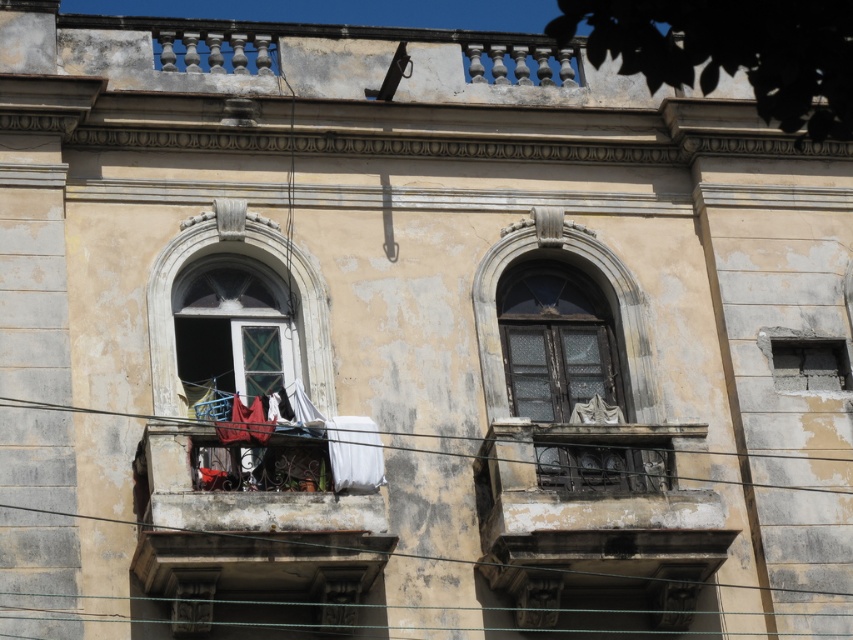
Can you confirm if metallic wire at lower center is taller than concrete/rough wall at right?

Yes, metallic wire at lower center is taller than concrete/rough wall at right.

Describe the element at coordinates (73, 408) in the screenshot. I see `metallic wire at lower center` at that location.

You are a GUI agent. You are given a task and a screenshot of the screen. Output one action in this format:
    pyautogui.click(x=<x>, y=<y>)
    Task: Click on the metallic wire at lower center
    This screenshot has height=640, width=853.
    Given the screenshot: What is the action you would take?
    tap(73, 408)

Is point (601, 436) behind point (819, 371)?

No, it is in front of (819, 371).

Does dark glass window at center come behind concrete/rough wall at right?

No, dark glass window at center is in front of concrete/rough wall at right.

What do you see at coordinates (569, 358) in the screenshot? I see `dark glass window at center` at bounding box center [569, 358].

Identify the location of dark glass window at center. The height and width of the screenshot is (640, 853). (569, 358).

Is dark glass window at center positioned behind matte glass window at center?

That is False.

From the picture: Does dark glass window at center have a lesser width compared to matte glass window at center?

In fact, dark glass window at center might be wider than matte glass window at center.

Is point (566, 266) positioned in front of point (231, 330)?

No, it is behind (231, 330).

I want to click on dark glass window at center, so click(569, 358).